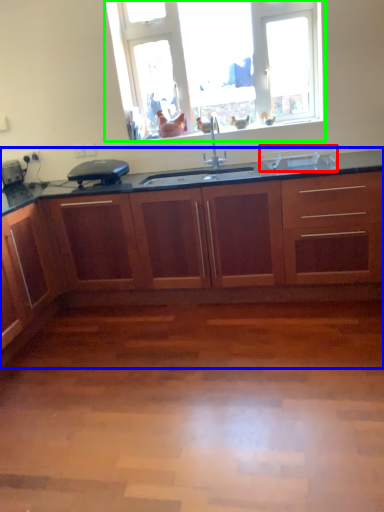
Question: Which object is positioned farthest from appliance (highlighted by a red box)? Select from cabinetry (highlighted by a blue box) and window (highlighted by a green box).

Choices:
 (A) cabinetry
 (B) window

Answer: (A)